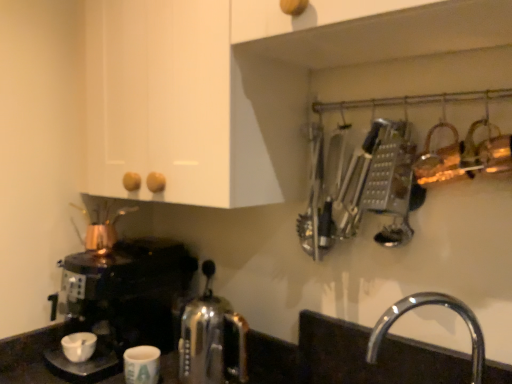
Question: Is white matte coffee cup at lower left, which appears as the second coffee cup when viewed from the right, to the left or to the right of shiny black coffee maker at left in the image?

Choices:
 (A) right
 (B) left

Answer: (B)

Question: Is white matte coffee cup at lower left, which appears as the second coffee cup when viewed from the right, inside or outside of shiny black coffee maker at left?

Choices:
 (A) inside
 (B) outside

Answer: (A)

Question: Estimate the real-world distances between objects in this image. Which object is farther from the white matte coffee cup at lower left, acting as the 1th coffee cup starting from the left?

Choices:
 (A) chrome/metallic faucet at lower right
 (B) satin chrome kettle at center
 (C) metallic silver grater at upper right
 (D) shiny black coffee maker at left
 (E) copper metallic tea pot at left

Answer: (A)

Question: Estimate the real-world distances between objects in this image. Which object is farther from the metallic silver grater at upper right?

Choices:
 (A) satin chrome kettle at center
 (B) white matte coffee cup at lower center, the second coffee cup in the left-to-right sequence
 (C) copper metallic tea pot at left
 (D) white matte coffee cup at lower left, acting as the 1th coffee cup starting from the left
 (E) chrome/metallic faucet at lower right

Answer: (D)